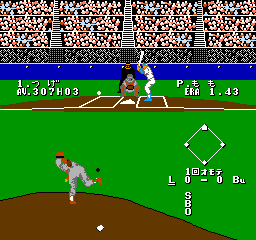
The image size is (256, 240). Find the location of `pitcher`. pitcher is located at coordinates (74, 166).